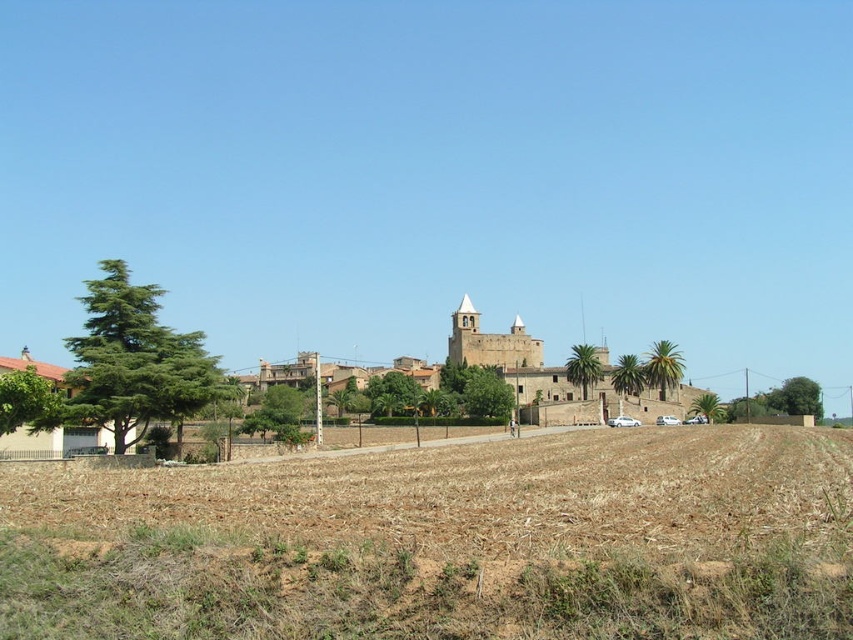
You are a farmer standing at the edge of the brown soil at lower center. You want to reach the brown stone town at center to deliver some crops. Which direction should you walk to get there?

The brown soil at lower center is not as tall as the brown stone town at center, so you should walk towards the higher elevation where the brown stone town at center is located.